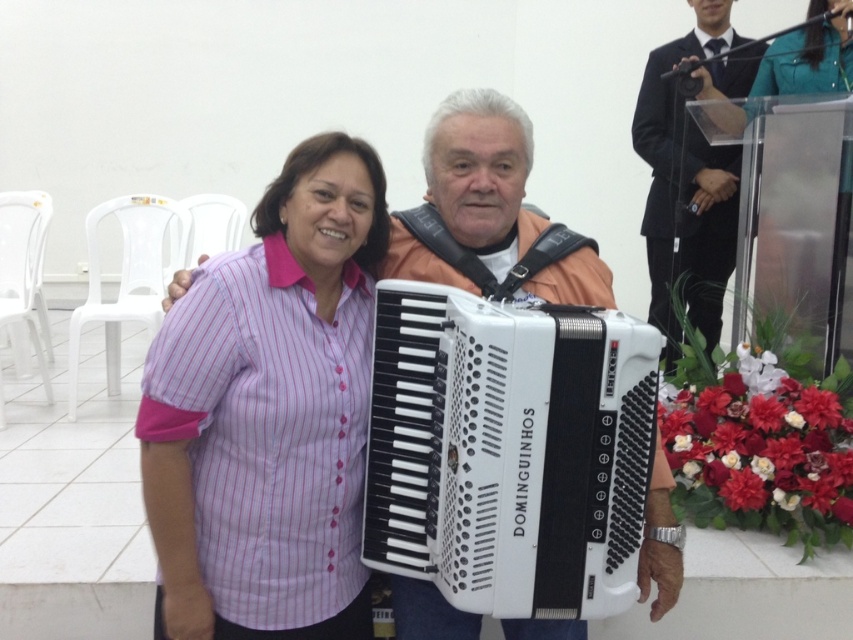
You are a photographer at this event and need to ensure both the pink striped shirt at center and the white plastic accordion at center are visible in the photo. Which object should you focus on first to ensure it doesn

The pink striped shirt at center is larger in size than the white plastic accordion at center, so you should focus on the pink striped shirt at center first to ensure it is in clear focus before adjusting for the smaller accordion.